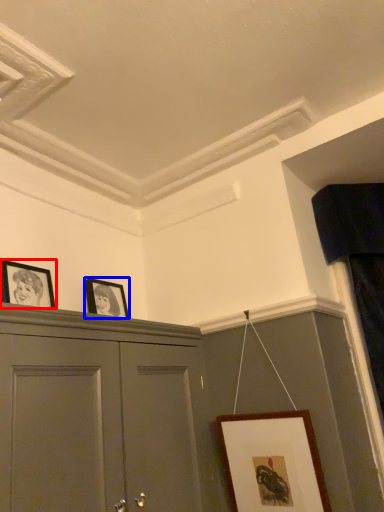
Question: Among these objects, which one is farthest to the camera, picture frame (highlighted by a red box) or picture frame (highlighted by a blue box)?

Choices:
 (A) picture frame
 (B) picture frame

Answer: (B)